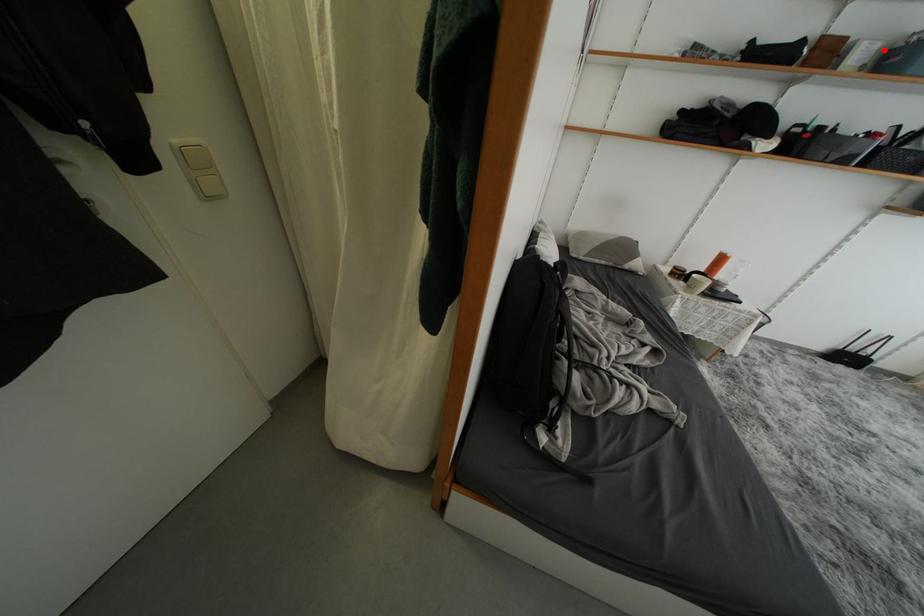
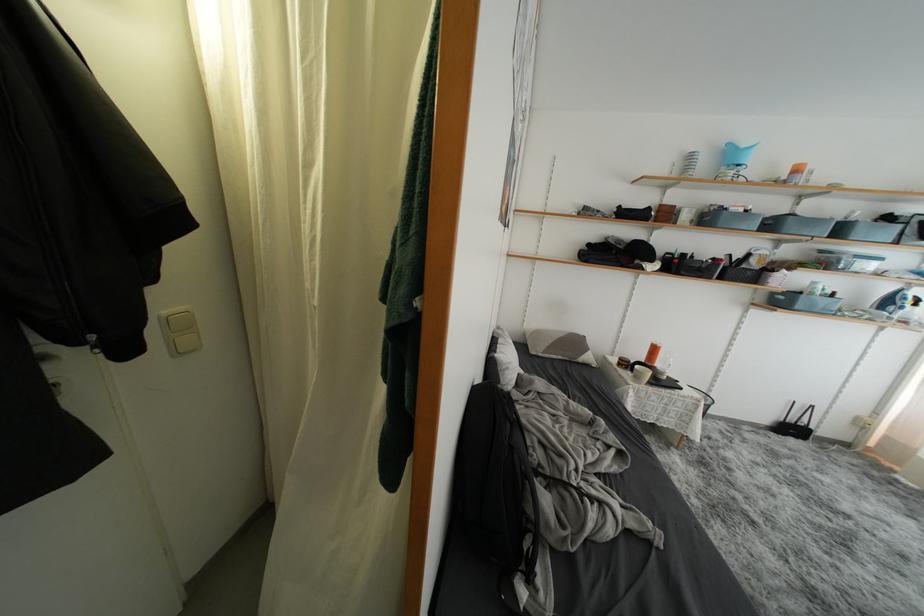
Question: I am providing you with two images of the same scene from different viewpoints. A red point is marked on the first image. Is the red point's position out of view in image 2?

Choices:
 (A) Yes
 (B) No

Answer: (B)